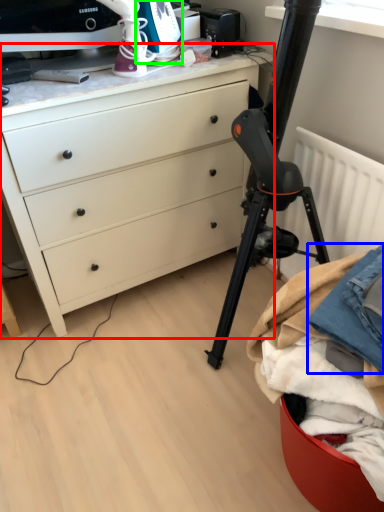
Question: Based on their relative distances, which object is nearer to chest of drawers (highlighted by a red box)? Choose from clothing (highlighted by a blue box) and appliance (highlighted by a green box).

Choices:
 (A) clothing
 (B) appliance

Answer: (B)